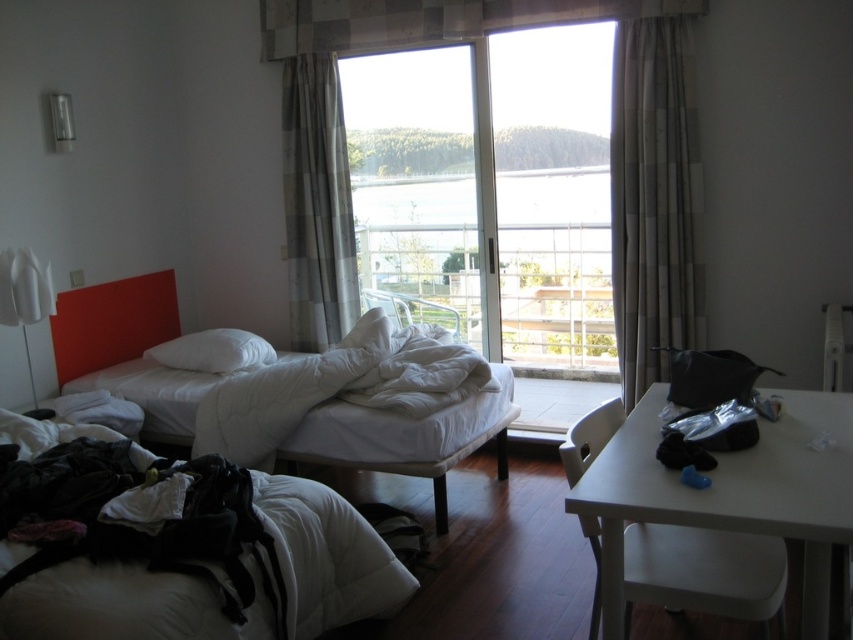
Question: Which point is farther from the camera taking this photo?

Choices:
 (A) (376, 216)
 (B) (136, 288)
 (C) (287, 212)
 (D) (440, 205)

Answer: (A)

Question: Is white cotton bed at center wider than white soft pillow at upper center?

Choices:
 (A) no
 (B) yes

Answer: (A)

Question: Which is nearer to the white soft pillow at upper center?

Choices:
 (A) beige textured curtain at right
 (B) white cotton bed at center

Answer: (B)

Question: Is transparent glass screen door at center bigger than white plastic table at lower right?

Choices:
 (A) yes
 (B) no

Answer: (A)

Question: Which point is farther to the camera?

Choices:
 (A) transparent glass window at center
 (B) white plastic table at lower right
 (C) white soft pillow at upper center

Answer: (C)

Question: Is beige textured curtain at right positioned behind white soft pillow at upper center?

Choices:
 (A) no
 (B) yes

Answer: (A)